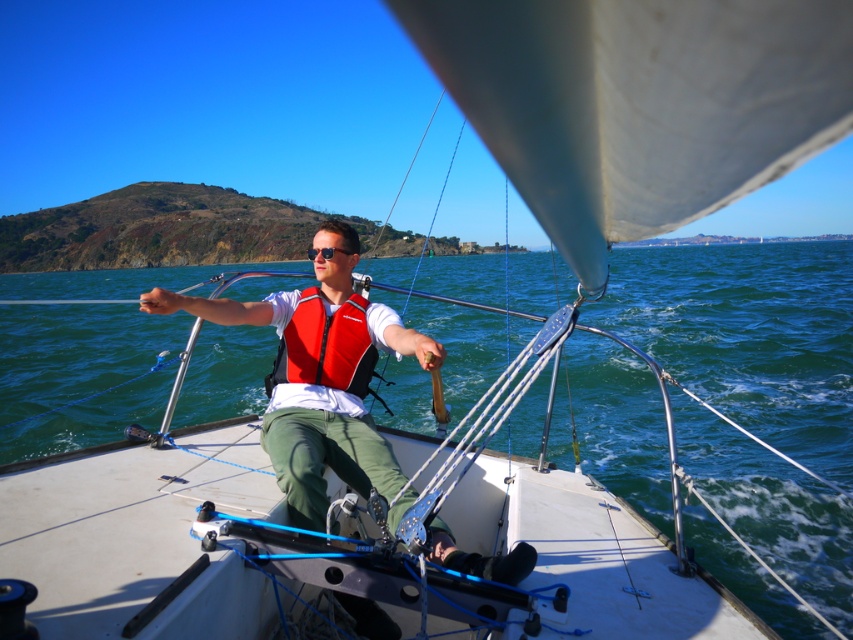
You are a GUI agent. You are given a task and a screenshot of the screen. Output one action in this format:
    pyautogui.click(x=<x>, y=<y>)
    Task: Click on the matte red life vest at center
    The width and height of the screenshot is (853, 640).
    Given the screenshot: What is the action you would take?
    pyautogui.click(x=318, y=376)

Is matte red life vest at center below sunglasses at center?

Yes.

At what (x,y) coordinates should I click in order to perform the action: click on matte red life vest at center. Please return your answer as a coordinate pair (x, y). Looking at the image, I should click on (318, 376).

At what (x,y) coordinates should I click in order to perform the action: click on matte red life vest at center. Please return your answer as a coordinate pair (x, y). The height and width of the screenshot is (640, 853). Looking at the image, I should click on 318,376.

Is red nylon life jacket at center to the left of sunglasses at center from the viewer's perspective?

In fact, red nylon life jacket at center is to the right of sunglasses at center.

Does red nylon life jacket at center lie in front of sunglasses at center?

Yes, it is.

Describe the element at coordinates (326, 346) in the screenshot. This screenshot has height=640, width=853. I see `red nylon life jacket at center` at that location.

I want to click on red nylon life jacket at center, so click(326, 346).

Is point (312, 292) in front of point (364, 328)?

No, it is not.

Measure the distance between point (285, 476) and camera.

Point (285, 476) and camera are 8.28 feet apart from each other.

Where is `matte red life vest at center`? The width and height of the screenshot is (853, 640). matte red life vest at center is located at coordinates (318, 376).